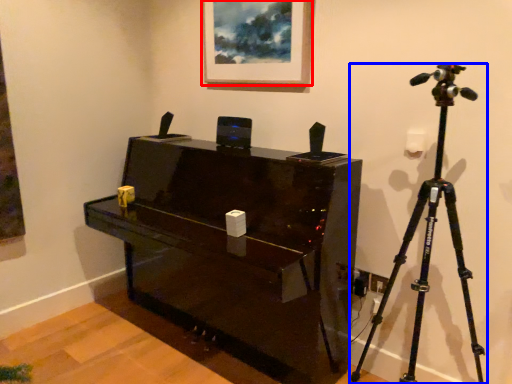
Question: Among these objects, which one is nearest to the camera, picture frame (highlighted by a red box) or tripod (highlighted by a blue box)?

Choices:
 (A) picture frame
 (B) tripod

Answer: (B)